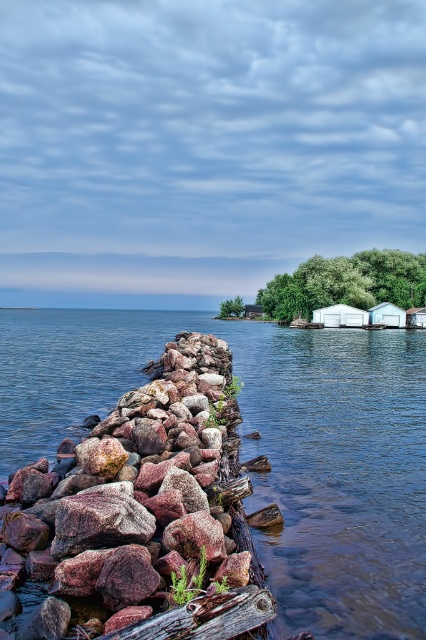
Which of these two, white matte shed at center-right or wooden cabin at center, stands shorter?

white matte shed at center-right is shorter.

Identify the location of white matte shed at center-right. (386, 316).

Is clear water at center to the right of white matte cabin at center-right from the viewer's perspective?

In fact, clear water at center is to the left of white matte cabin at center-right.

Who is more distant from viewer, (x=371, y=428) or (x=405, y=321)?

The point (x=405, y=321) is behind.

The image size is (426, 640). What do you see at coordinates (337, 474) in the screenshot?
I see `clear water at center` at bounding box center [337, 474].

This screenshot has height=640, width=426. I want to click on clear water at center, so click(x=337, y=474).

Between clear water at center and wooden cabin at center, which one has more height?

wooden cabin at center

Is clear water at center smaller than wooden cabin at center?

No, clear water at center is not smaller than wooden cabin at center.

Consider the image. Who is more forward, (365,429) or (250,316)?

Positioned in front is point (365,429).

Identify the location of clear water at center. (337, 474).